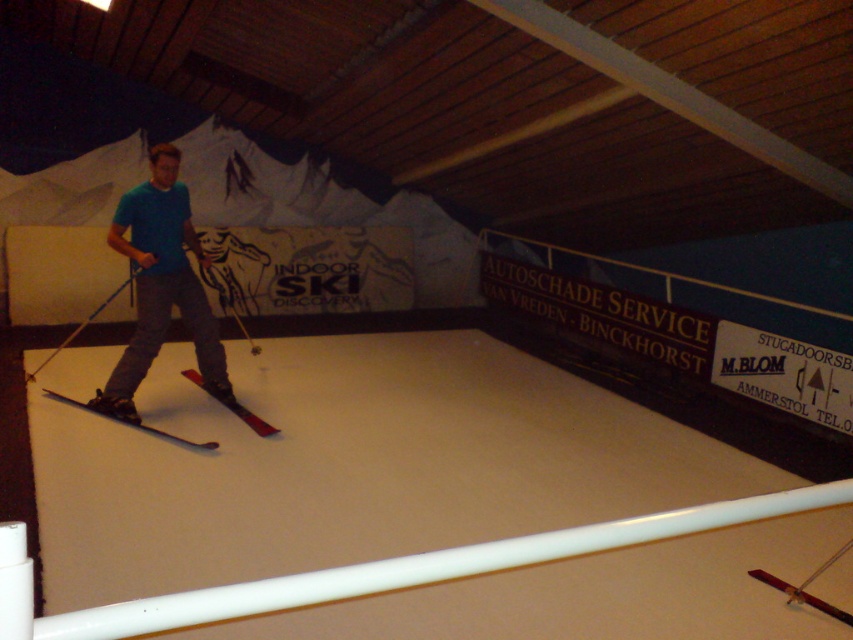
Is blue matte/solid shirt at center bigger than blue plastic ski pole at center?

No.

Can you confirm if blue matte/solid shirt at center is positioned below blue plastic ski pole at center?

Incorrect, blue matte/solid shirt at center is not positioned below blue plastic ski pole at center.

The image size is (853, 640). I want to click on blue matte/solid shirt at center, so click(161, 284).

Which is behind, point (148, 426) or point (33, 376)?

Point (33, 376)

Does point (132, 420) come closer to viewer compared to point (131, 284)?

Yes, point (132, 420) is closer to viewer.

This screenshot has width=853, height=640. What are the coordinates of `shiny black ski at center` in the screenshot? It's located at (128, 420).

Is blue matte/solid shirt at center shorter than shiny black ski at center?

No, blue matte/solid shirt at center is not shorter than shiny black ski at center.

The image size is (853, 640). What are the coordinates of `blue matte/solid shirt at center` in the screenshot? It's located at (161, 284).

Locate an element on the screen. blue matte/solid shirt at center is located at coordinates pyautogui.click(x=161, y=284).